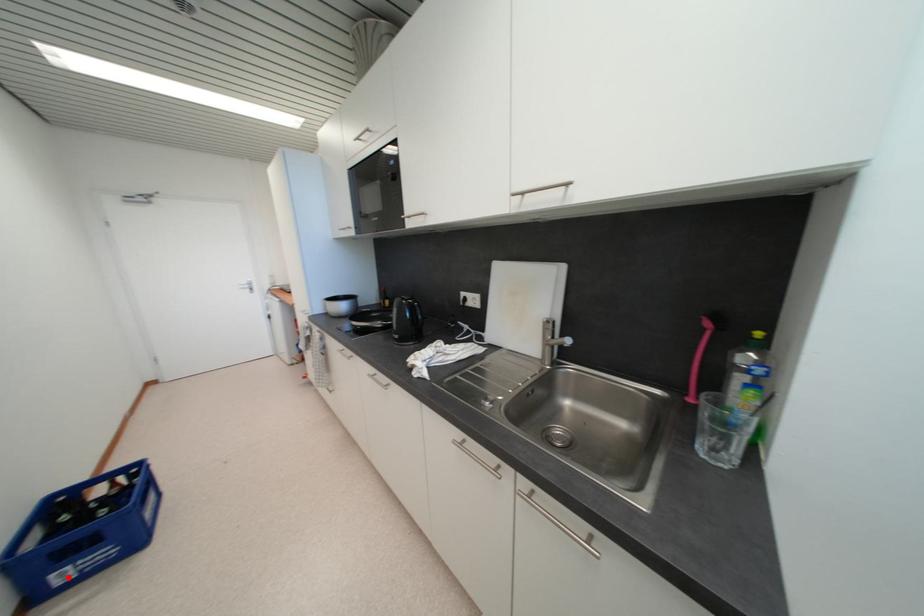
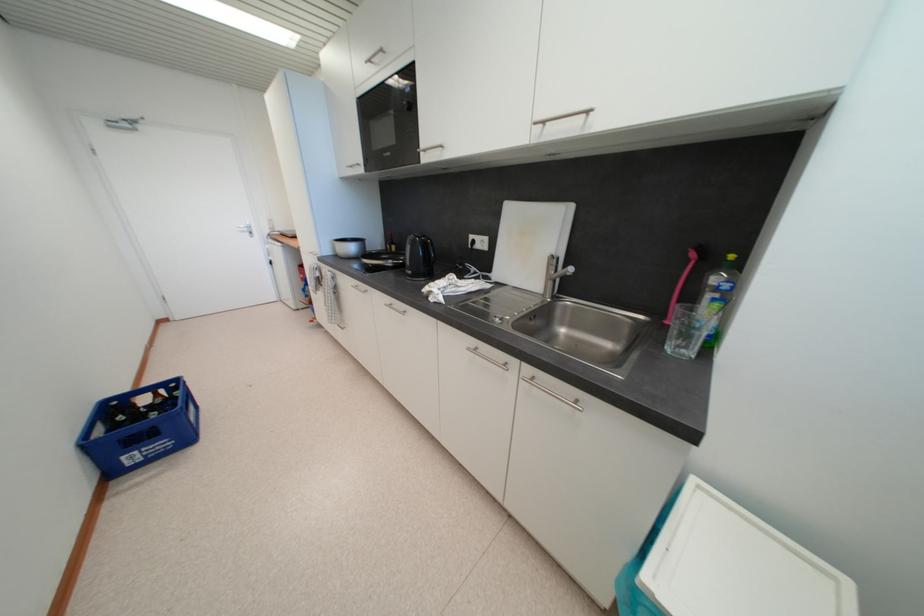
Question: I am providing you with two images of the same scene from different viewpoints. In image1, a red point is highlighted. Considering the same 3D point in image2, which of the following is correct?

Choices:
 (A) It is closer
 (B) It is farther

Answer: (A)